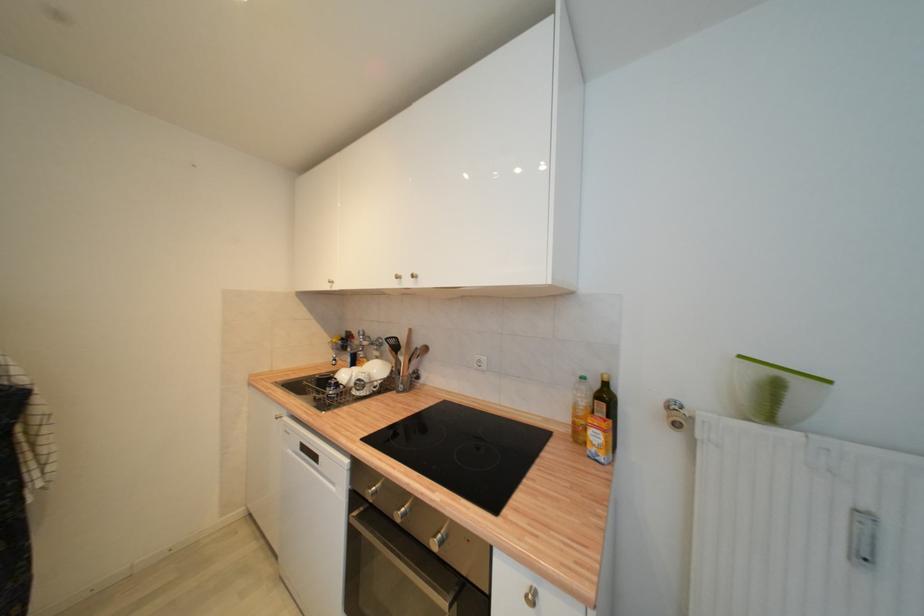
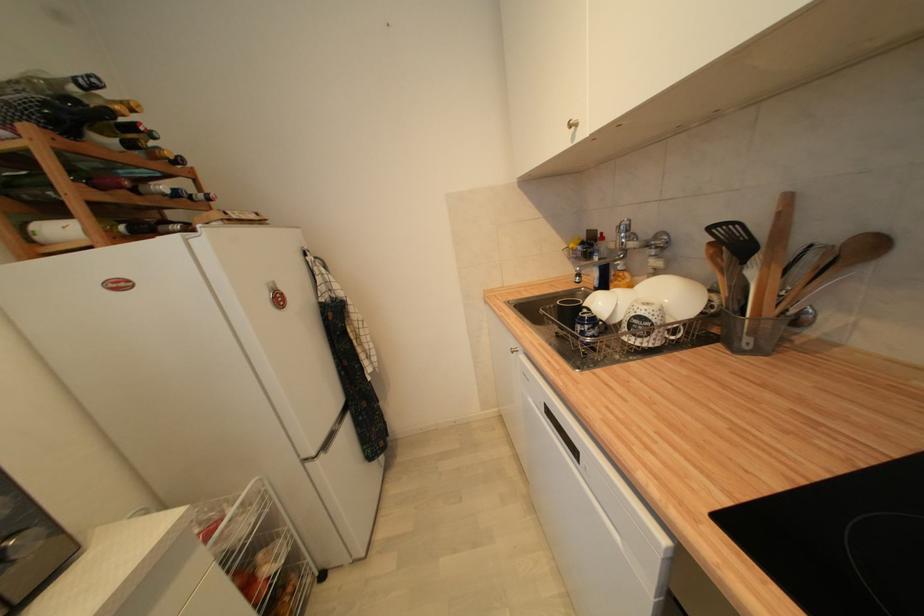
The point at (369, 337) is marked in the first image. Where is the corresponding point in the second image?

(633, 233)